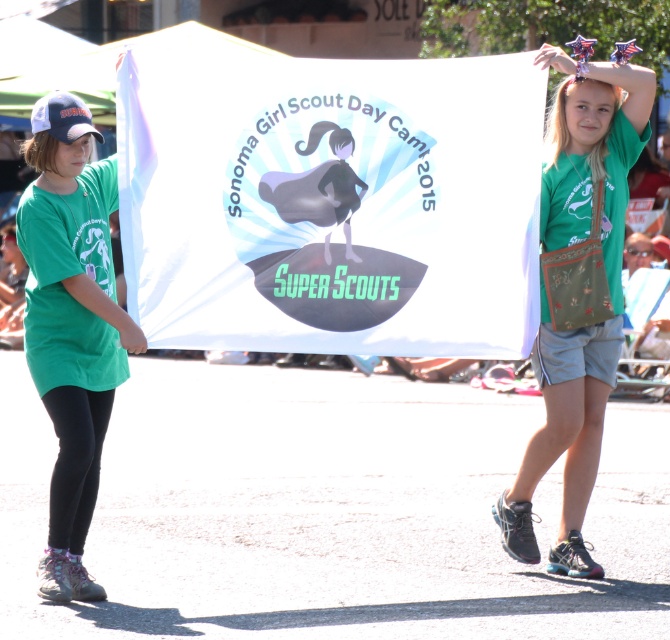
Question: Is the position of green fabric shirt at left more distant than that of green fabric purse at center?

Choices:
 (A) no
 (B) yes

Answer: (A)

Question: Can you confirm if green fabric shirt at left is positioned above green fabric purse at center?

Choices:
 (A) no
 (B) yes

Answer: (A)

Question: Is green fabric shirt at left further to the viewer compared to green fabric purse at center?

Choices:
 (A) no
 (B) yes

Answer: (A)

Question: Among these points, which one is nearest to the camera?

Choices:
 (A) (588, 193)
 (B) (31, 192)

Answer: (B)